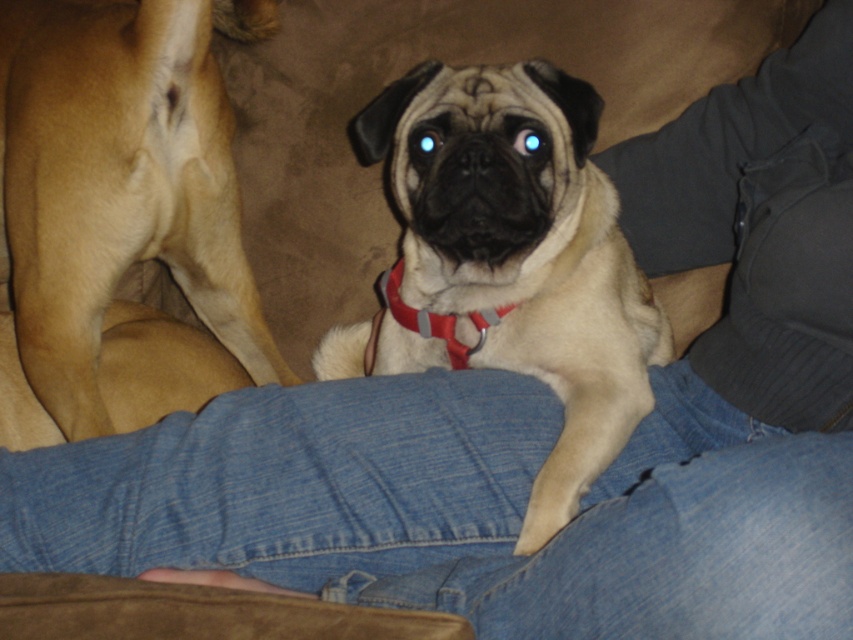
You are a photographer trying to capture a closeup of the light brown fur at left and the red nylon collar at center. Since you want to focus on both objects clearly, which one should you adjust the camera focus to prioritize?

The light brown fur at left has a larger size compared to the red nylon collar at center, so you should prioritize focusing on the light brown fur at left to ensure it is in clear focus.

You are a photographer adjusting your camera settings to capture both the light brown fur at left and the red nylon collar at center in focus. Which object should you focus on first to ensure proper depth of field?

The light brown fur at left is closer to the viewer than the red nylon collar at center, so you should focus on the light brown fur at left first to ensure proper depth of field.